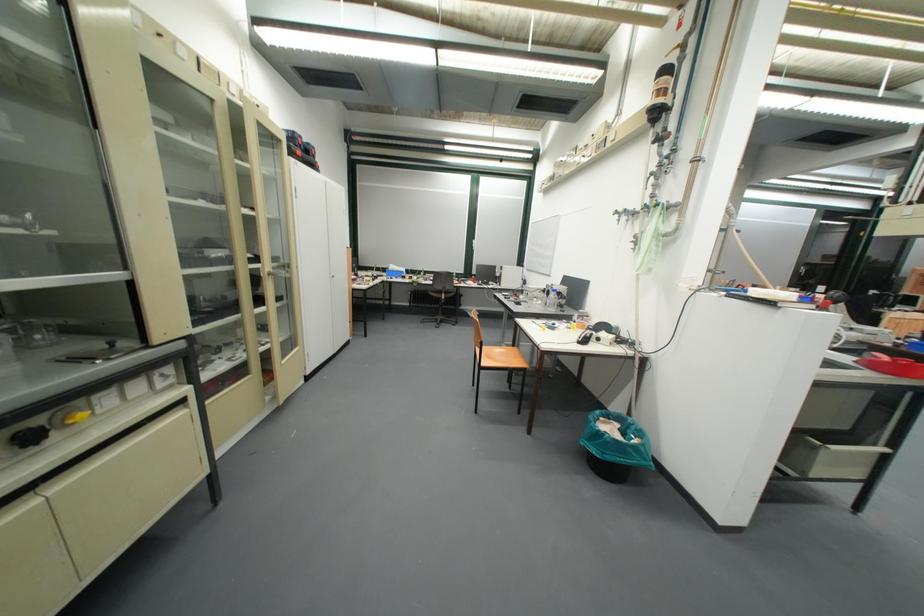
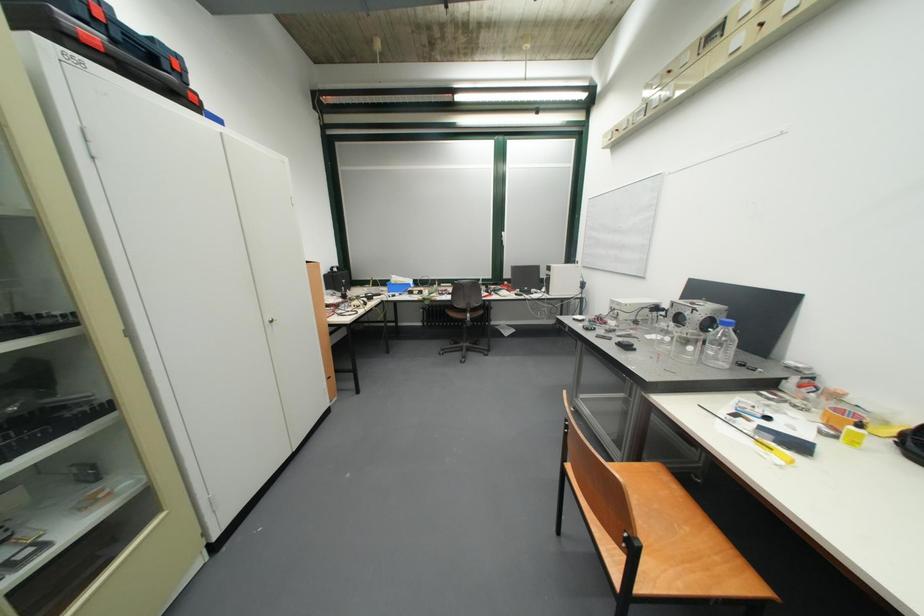
Question: The images are taken continuously from a first-person perspective. In which direction are you moving?

Choices:
 (A) Left
 (B) Right
 (C) Forward
 (D) Backward

Answer: (C)